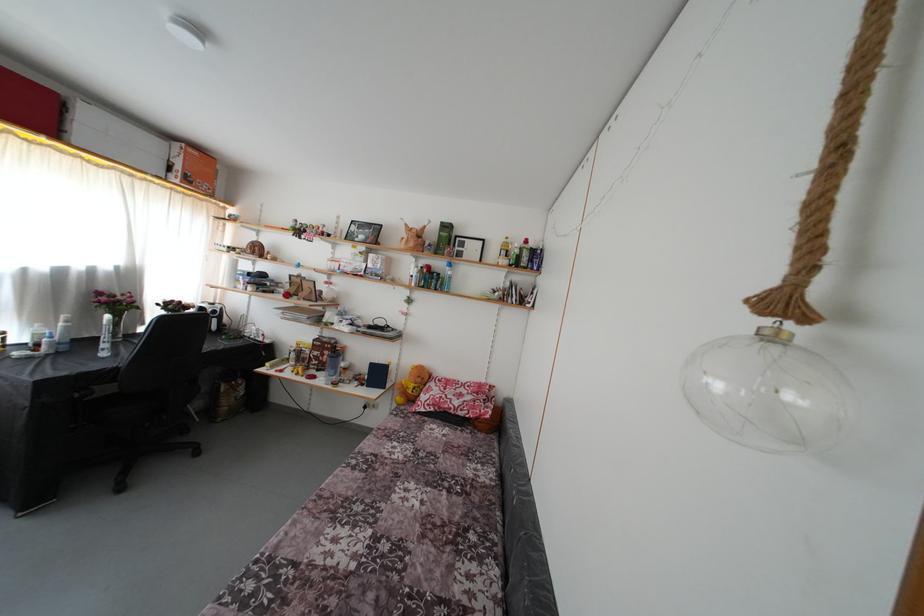
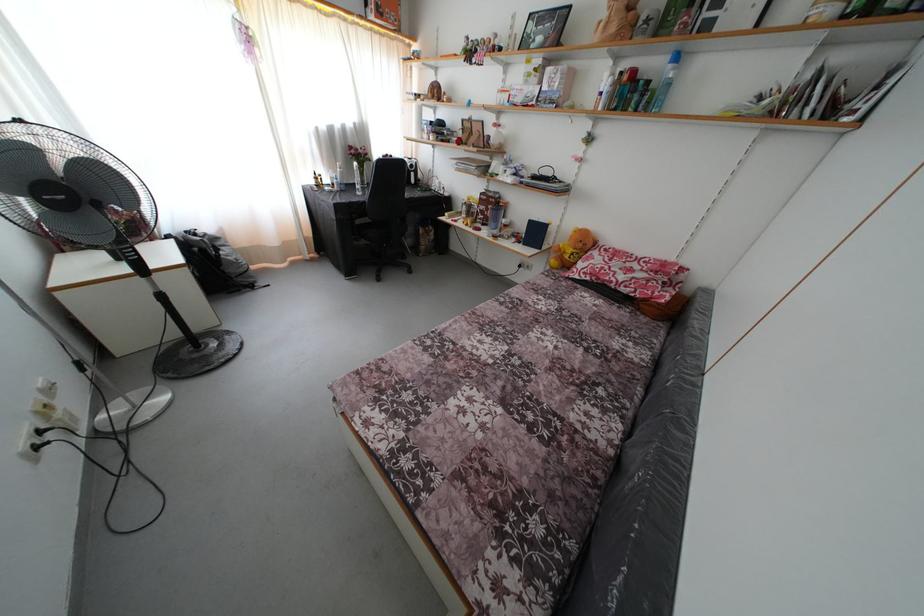
Find the pixel in the second image that matches (370,413) in the first image.

(525, 272)